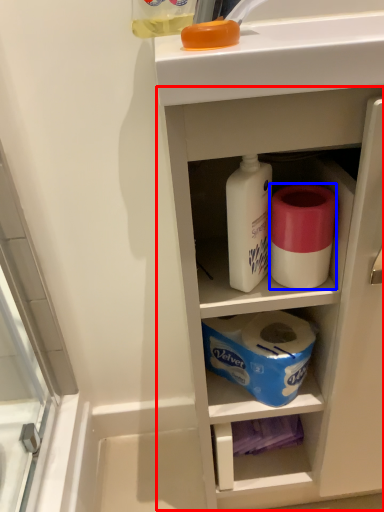
Question: Which point is further to the camera, cabinetry (highlighted by a red box) or toilet paper (highlighted by a blue box)?

Choices:
 (A) cabinetry
 (B) toilet paper

Answer: (B)